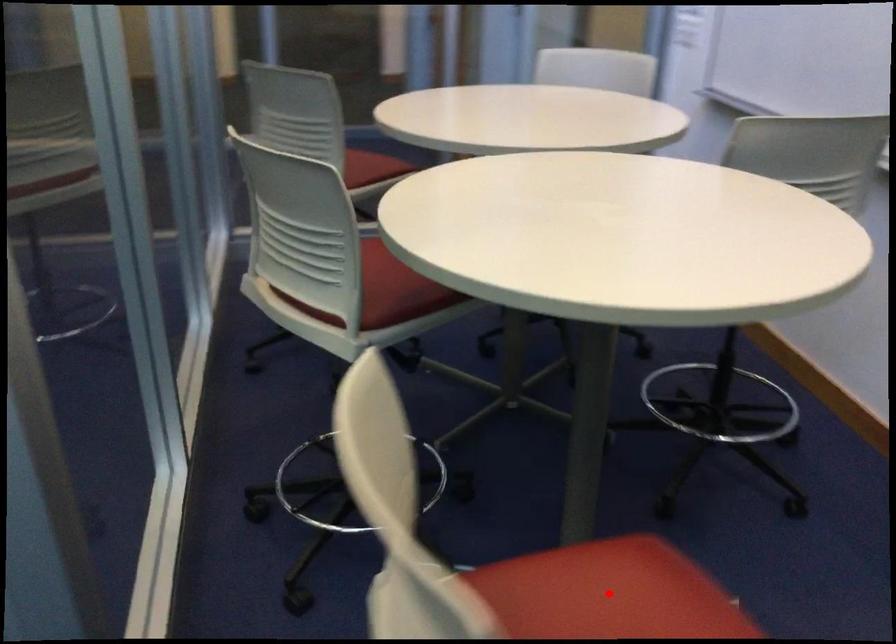
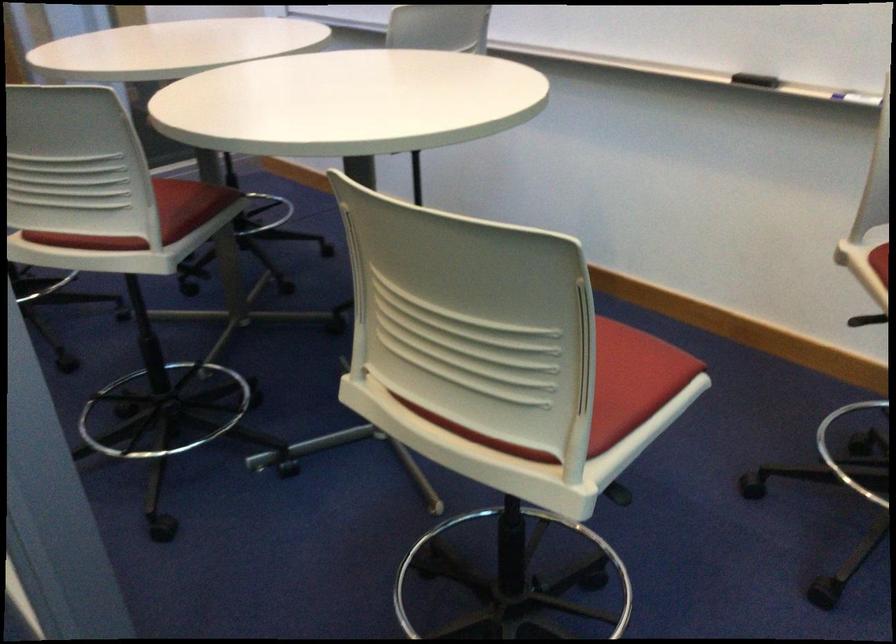
Question: I am providing you with two images of the same scene from different viewpoints. A red point is marked on the first image. Can you still see the location of the red point in image 2?

Choices:
 (A) Yes
 (B) No

Answer: (B)